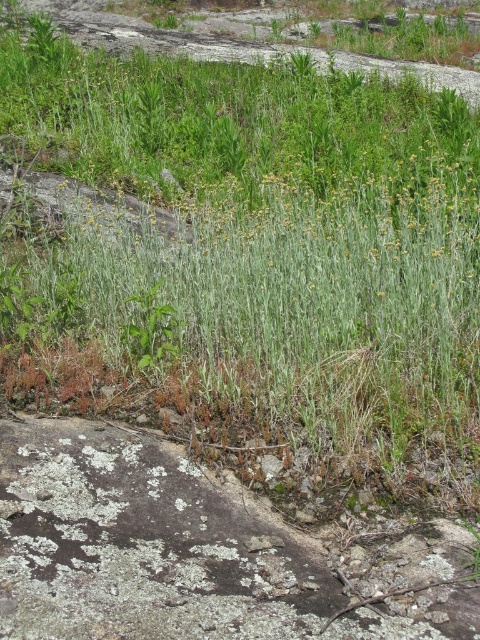
From the picture: Who is positioned more to the right, green grass at center or green leafy plant at center?

From the viewer's perspective, green grass at center appears more on the right side.

Based on the photo, is green grass at center wider than green leafy plant at center?

Correct, the width of green grass at center exceeds that of green leafy plant at center.

Who is more distant from viewer, [343,451] or [145,310]?

The point [145,310] is more distant.

Identify the location of green grass at center. (304, 307).